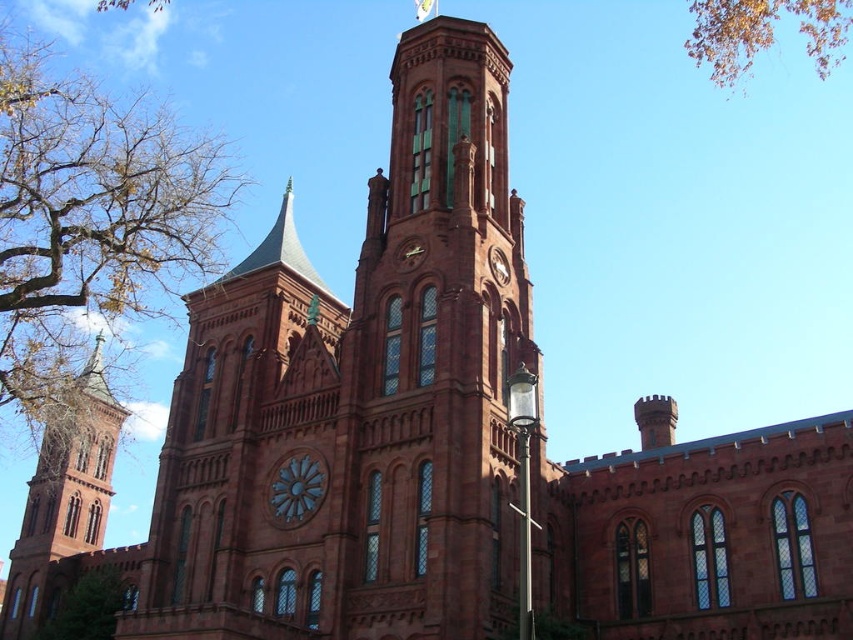
Question: Estimate the real-world distances between objects in this image. Which object is closer to the brown leafy tree at left?

Choices:
 (A) green leafy tree at lower left
 (B) yellow leafy branches at upper right
 (C) matte brick tower at center

Answer: (C)

Question: Estimate the real-world distances between objects in this image. Which object is closer to the yellow leafy branches at upper right?

Choices:
 (A) matte brick tower at center
 (B) brown leafy tree at left

Answer: (A)

Question: Which object is closer to the camera taking this photo?

Choices:
 (A) green leafy tree at lower left
 (B) brown leafy tree at left
 (C) yellow leafy branches at upper right
 (D) matte brick tower at center

Answer: (D)

Question: Can you confirm if matte brick tower at center is positioned below yellow leafy branches at upper right?

Choices:
 (A) no
 (B) yes

Answer: (B)

Question: Is matte brick tower at center bigger than green leafy tree at lower left?

Choices:
 (A) yes
 (B) no

Answer: (A)

Question: From the image, what is the correct spatial relationship of brown leafy tree at left in relation to green leafy tree at lower left?

Choices:
 (A) right
 (B) left

Answer: (B)